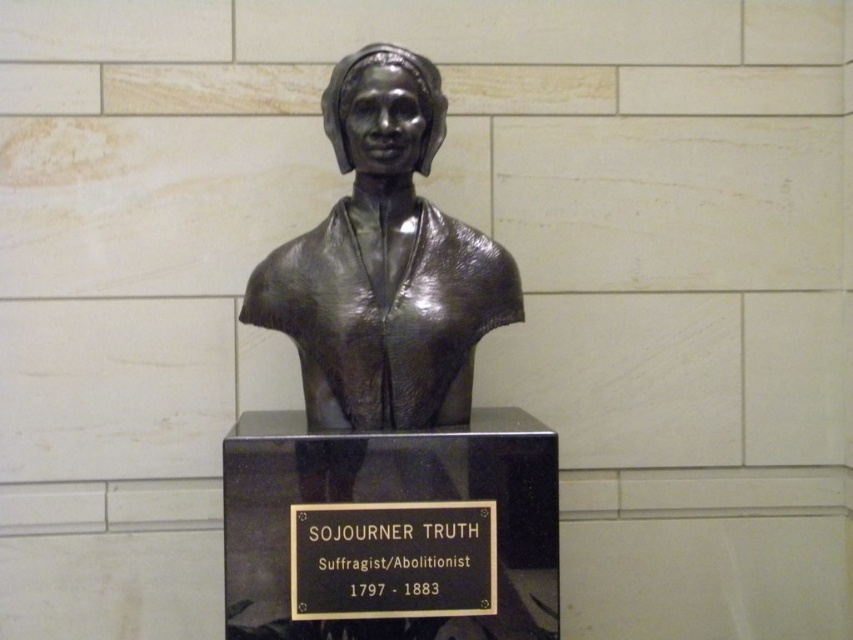
You are standing in front of the Sojourner Truth sculpture and want to take a photo. There are two points marked on the ground for optimal lighting. The first point is at coordinates point [311,380] and the second point is at point [419,552]. Which point is closer to the sculpture?

Point point [311,380] is behind point point [419,552], so the point closer to the sculpture would be point [419,552] since it is in front.